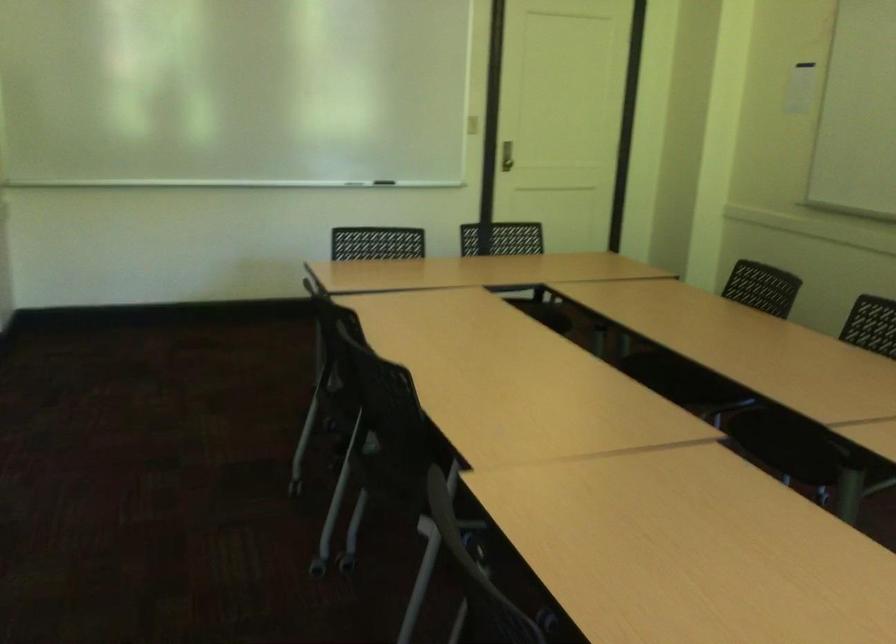
Find the location of a particular element. This screenshot has height=644, width=896. metal door handle is located at coordinates (506, 156).